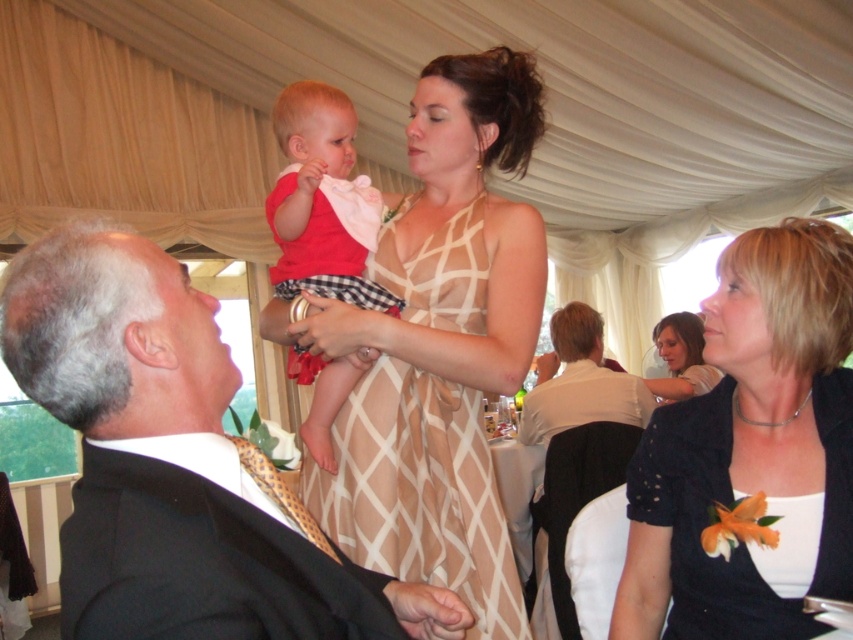
Is matte gold tie at left positioned before gold textured tie at lower left?

Yes.

Is point (178, 612) farther from camera compared to point (244, 440)?

No, it is in front of (244, 440).

The image size is (853, 640). I want to click on matte gold tie at left, so click(173, 464).

How far apart are matte gold tie at left and beige/white textured dress at center?

matte gold tie at left is 22.16 inches from beige/white textured dress at center.

Who is lower down, matte gold tie at left or beige/white textured dress at center?

matte gold tie at left is below.

Which is behind, point (91, 515) or point (352, 502)?

The point (352, 502) is more distant.

Locate an element on the screen. This screenshot has width=853, height=640. matte gold tie at left is located at coordinates (173, 464).

Between point (485, 508) and point (299, 145), which one is positioned behind?

The point (299, 145) is behind.

What do you see at coordinates (421, 492) in the screenshot? This screenshot has height=640, width=853. I see `beige/white textured dress at center` at bounding box center [421, 492].

Between point (344, 525) and point (318, 138), which one is positioned in front?

Point (344, 525) is in front.

Identify the location of beige/white textured dress at center. The height and width of the screenshot is (640, 853). (421, 492).